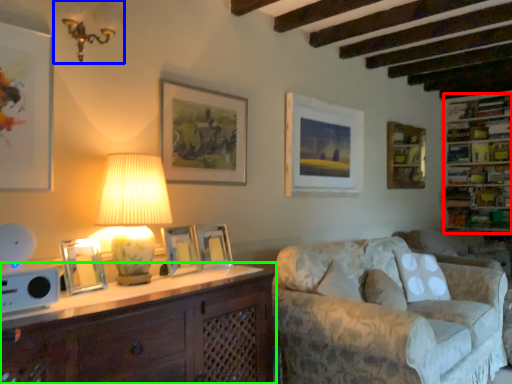
Question: Based on their relative distances, which object is nearer to shelf (highlighted by a red box)? Choose from lamp (highlighted by a blue box) and cabinetry (highlighted by a green box).

Choices:
 (A) lamp
 (B) cabinetry

Answer: (B)